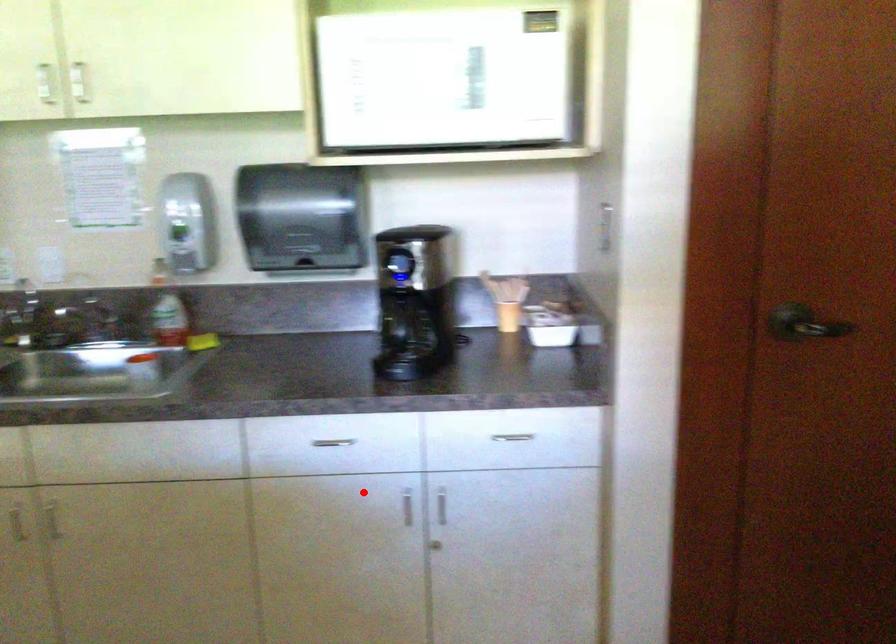
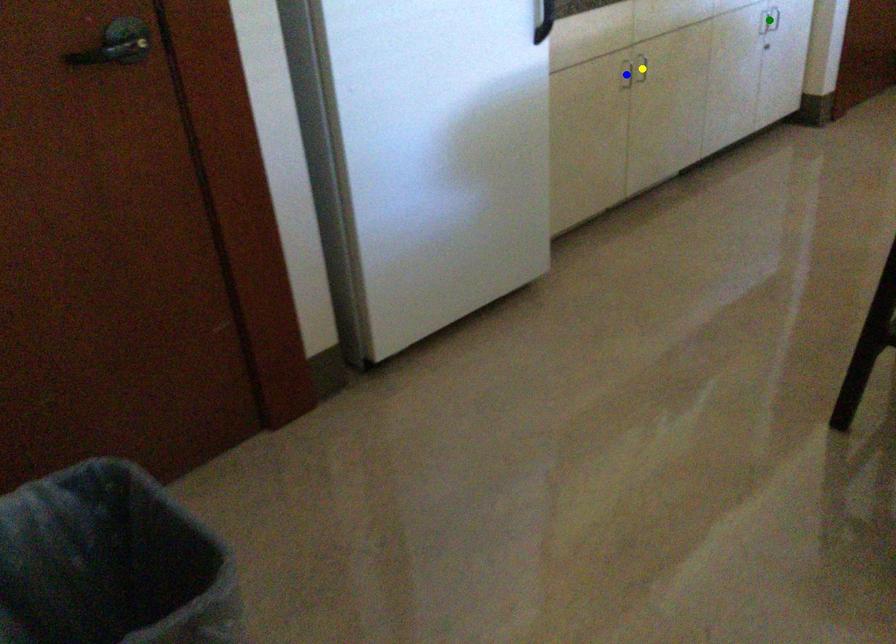
Question: I am providing you with two images of the same scene from different viewpoints. A red point is marked on the first image. You are given multiple points on the second image. Which spot in image 2 lines up with the point in image 1?

Choices:
 (A) green point
 (B) yellow point
 (C) blue point

Answer: (A)